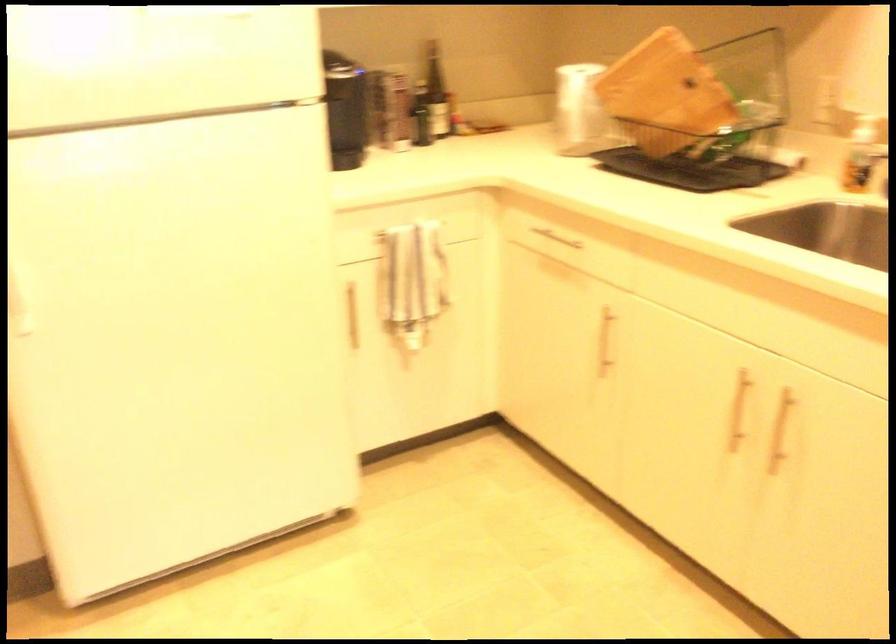
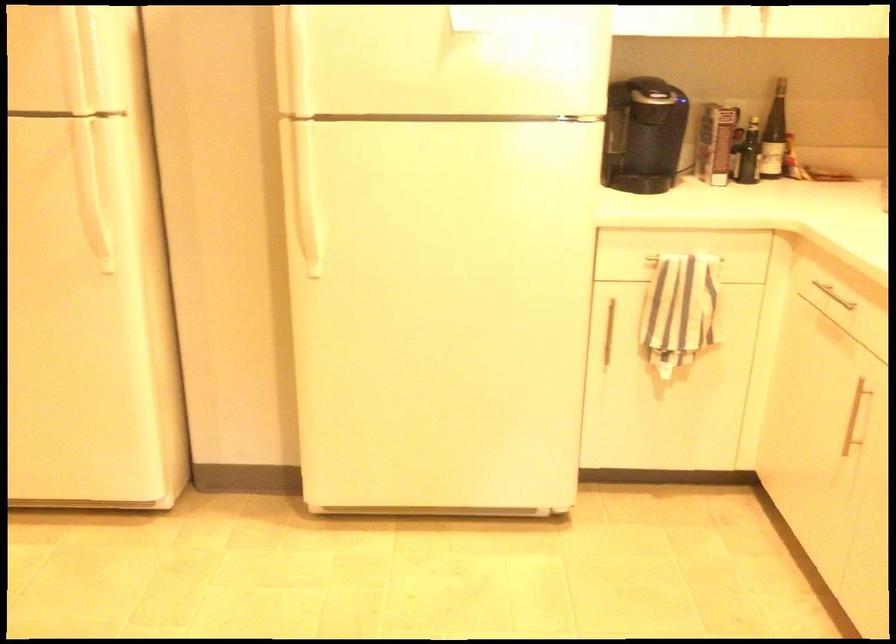
Question: In a continuous first-person perspective shot, in which direction is the camera moving?

Choices:
 (A) Left
 (B) Right
 (C) Forward
 (D) Backward

Answer: (B)